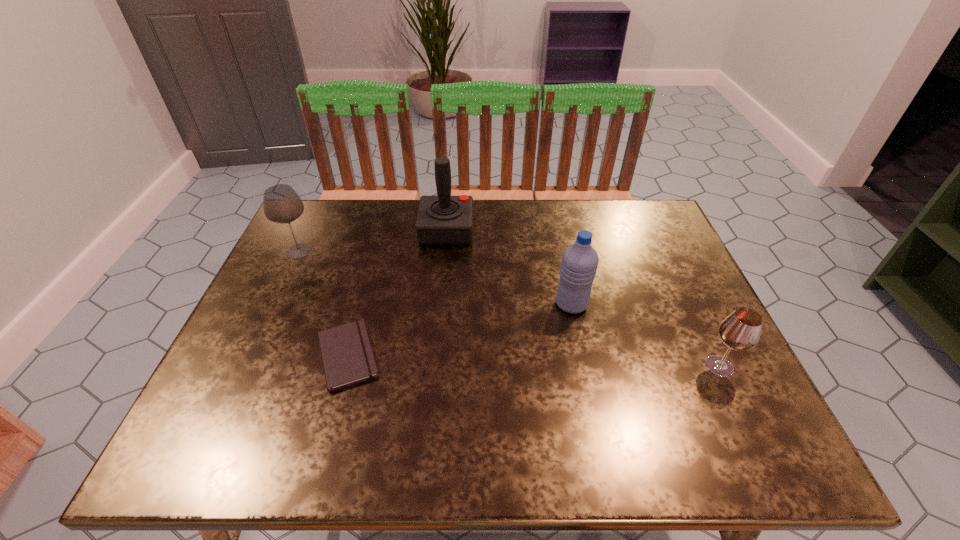
Where is `free spot located 0.060m on the back of the second object from right to left`? This screenshot has height=540, width=960. free spot located 0.060m on the back of the second object from right to left is located at coordinates (565, 276).

The width and height of the screenshot is (960, 540). Identify the location of vacant region located 0.280m on the front of the farther wineglass. (x=256, y=342).

The width and height of the screenshot is (960, 540). What are the coordinates of `vacant space located 0.360m on the back of the rightmost object` in the screenshot? It's located at (664, 252).

The height and width of the screenshot is (540, 960). Identify the location of vacant region located on the back of the checkbook. (368, 281).

Where is `joystick located at the far edge`? joystick located at the far edge is located at coordinates (443, 219).

Find the location of a particular element. This screenshot has height=540, width=960. wineglass that is at the far edge is located at coordinates (281, 204).

Image resolution: width=960 pixels, height=540 pixels. Identify the location of object that is at the left edge. (281, 204).

The width and height of the screenshot is (960, 540). Find the location of `object that is positioned at the right edge`. object that is positioned at the right edge is located at coordinates (741, 330).

I want to click on object present at the far left corner, so click(281, 204).

The image size is (960, 540). Identify the location of vacant space at the far edge. (419, 202).